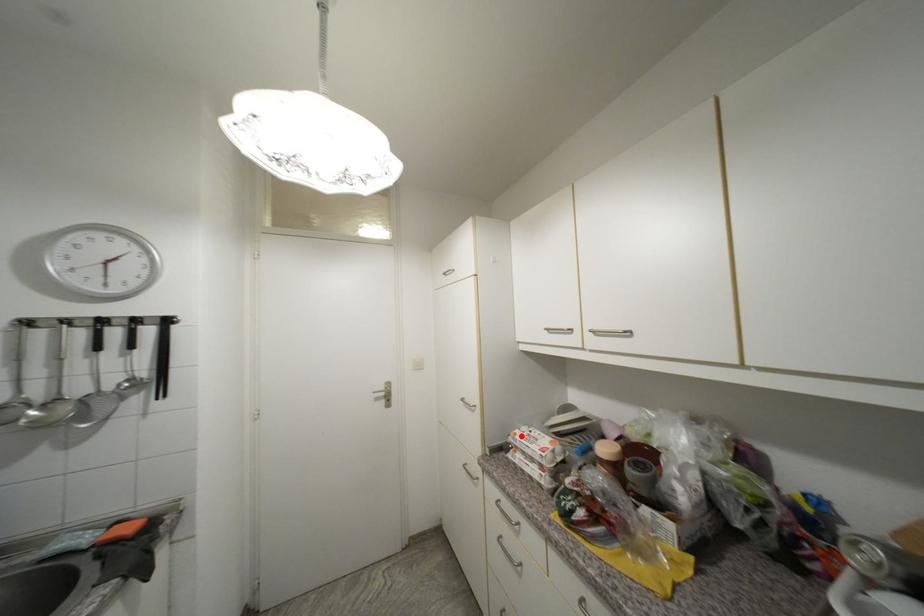
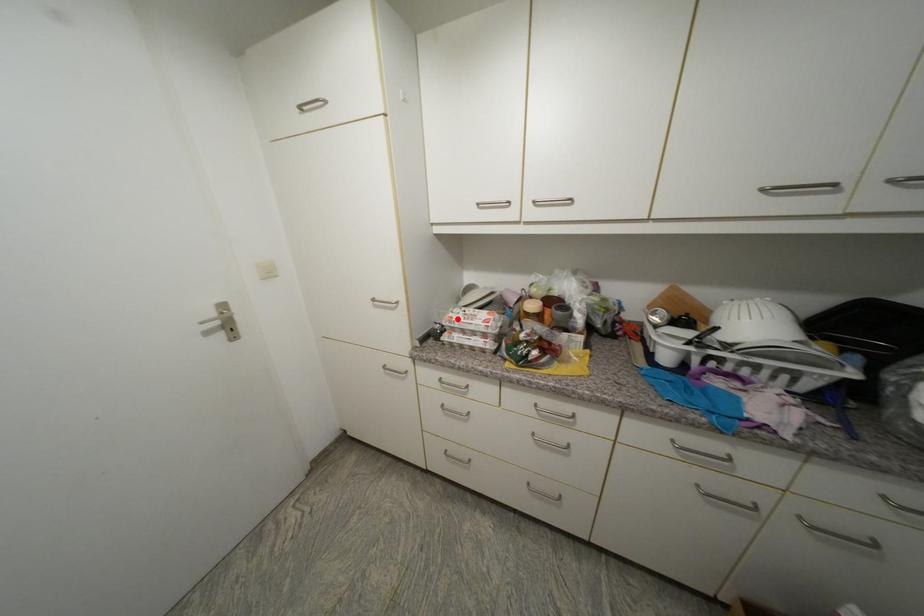
I am providing you with two images of the same scene from different viewpoints. A red point is marked on the first image and another point is marked on the second image. Do the highlighted points in image1 and image2 indicate the same real-world spot?

Yes